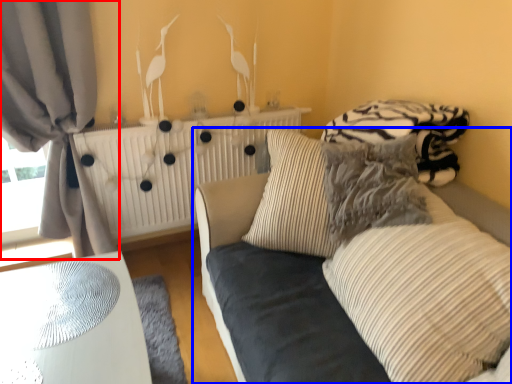
Question: Which object is closer to the camera taking this photo, curtain (highlighted by a red box) or studio couch (highlighted by a blue box)?

Choices:
 (A) curtain
 (B) studio couch

Answer: (B)